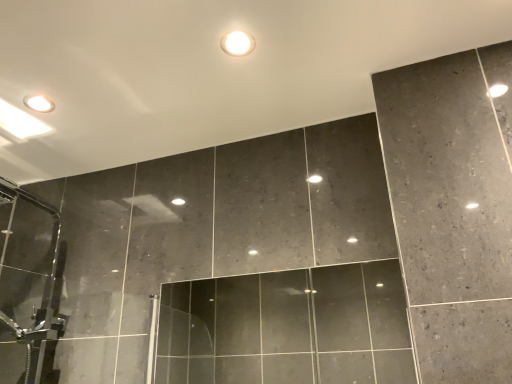
In order to face matte white droplight at upper center, should I rotate leftwards or rightwards?

You should rotate left by 2.552 degrees.

What do you see at coordinates (287, 327) in the screenshot?
I see `transparent glass door at center` at bounding box center [287, 327].

Identify the location of matte white droplight at upper center. (237, 43).

From a real-world perspective, is transparent glass door at center on matte white droplight at upper center?

No.

Does transparent glass door at center come behind matte white droplight at upper center?

No, transparent glass door at center is closer to the camera.

In the scene shown: Is transparent glass door at center not near matte white droplight at upper center?

transparent glass door at center is far away from matte white droplight at upper center.

In the image, is transparent glass door at center on the left side or the right side of matte white droplight at upper center?

From the image, it's evident that transparent glass door at center is to the right of matte white droplight at upper center.

Is matte white droplight at upper center further to the viewer compared to dark gray marble wall at upper center?

Yes, matte white droplight at upper center is further from the viewer.

Visually, is matte white droplight at upper center positioned to the left or to the right of dark gray marble wall at upper center?

In the image, matte white droplight at upper center appears on the right side of dark gray marble wall at upper center.

Can you tell me how much matte white droplight at upper center and dark gray marble wall at upper center differ in facing direction?

The angle between the facing direction of matte white droplight at upper center and the facing direction of dark gray marble wall at upper center is 0.0519 degrees.

Is matte white droplight at upper center taller than dark gray marble wall at upper center?

Incorrect, the height of matte white droplight at upper center is not larger of that of dark gray marble wall at upper center.

Which is more to the left, transparent glass door at center or dark gray marble wall at upper center?

dark gray marble wall at upper center.

Is transparent glass door at center bigger than dark gray marble wall at upper center?

Yes.

Who is more distant, transparent glass door at center or dark gray marble wall at upper center?

transparent glass door at center is further from the camera.

How many degrees apart are the facing directions of transparent glass door at center and dark gray marble wall at upper center?

The angle between the facing direction of transparent glass door at center and the facing direction of dark gray marble wall at upper center is 0.612 degrees.

The image size is (512, 384). I want to click on glass door that appears below the matte white droplight at upper center (from a real-world perspective), so click(287, 327).

Considering the relative positions of matte white droplight at upper center and transparent glass door at center in the image provided, is matte white droplight at upper center to the right of transparent glass door at center from the viewer's perspective?

In fact, matte white droplight at upper center is to the left of transparent glass door at center.

Considering their positions, is matte white droplight at upper center located in front of or behind transparent glass door at center?

matte white droplight at upper center is positioned farther from the viewer than transparent glass door at center.

What's the angular difference between matte white droplight at upper center and transparent glass door at center's facing directions?

0.561 degrees.

From the image's perspective, is dark gray marble wall at upper center on top of matte white droplight at upper center?

Actually, dark gray marble wall at upper center appears below matte white droplight at upper center in the image.

From a real-world perspective, is dark gray marble wall at upper center over matte white droplight at upper center?

Indeed, from a real-world perspective, dark gray marble wall at upper center stands above matte white droplight at upper center.

Is dark gray marble wall at upper center wider than matte white droplight at upper center?

Indeed, dark gray marble wall at upper center has a greater width compared to matte white droplight at upper center.

Can you confirm if dark gray marble wall at upper center is smaller than matte white droplight at upper center?

Actually, dark gray marble wall at upper center might be larger than matte white droplight at upper center.

Looking at this image, is transparent glass door at center at the back of dark gray marble wall at upper center?

That's not correct — dark gray marble wall at upper center is not looking away from transparent glass door at center.

Does dark gray marble wall at upper center have a greater width compared to transparent glass door at center?

Correct, the width of dark gray marble wall at upper center exceeds that of transparent glass door at center.

Is dark gray marble wall at upper center to the right of transparent glass door at center from the viewer's perspective?

No, dark gray marble wall at upper center is not to the right of transparent glass door at center.

Is dark gray marble wall at upper center next to transparent glass door at center?

No, dark gray marble wall at upper center is not making contact with transparent glass door at center.

Where is `droplight on the left of transparent glass door at center`? droplight on the left of transparent glass door at center is located at coordinates (237, 43).

This screenshot has height=384, width=512. Find the location of `backdrop located in front of the matte white droplight at upper center`. backdrop located in front of the matte white droplight at upper center is located at coordinates (205, 71).

Which object lies further to the anchor point transparent glass door at center, matte white droplight at upper center or dark gray marble wall at upper center?

The object further to transparent glass door at center is matte white droplight at upper center.

Considering their positions, is transparent glass door at center positioned further to matte white droplight at upper center than dark gray marble wall at upper center?

Among the two, transparent glass door at center is located further to matte white droplight at upper center.

From the image, which object appears to be farther from matte white droplight at upper center, dark gray marble wall at upper center or transparent glass door at center?

transparent glass door at center is positioned further to the anchor matte white droplight at upper center.

Which object lies nearer to the anchor point transparent glass door at center, dark gray marble wall at upper center or matte white droplight at upper center?

dark gray marble wall at upper center is positioned closer to the anchor transparent glass door at center.

Based on their spatial positions, is matte white droplight at upper center or transparent glass door at center closer to dark gray marble wall at upper center?

Among the two, matte white droplight at upper center is located nearer to dark gray marble wall at upper center.

From the picture: Considering their positions, is transparent glass door at center positioned closer to dark gray marble wall at upper center than matte white droplight at upper center?

matte white droplight at upper center.

At what (x,y) coordinates should I click in order to perform the action: click on backdrop that lies between matte white droplight at upper center and transparent glass door at center from top to bottom. Please return your answer as a coordinate pair (x, y). Looking at the image, I should click on (205, 71).